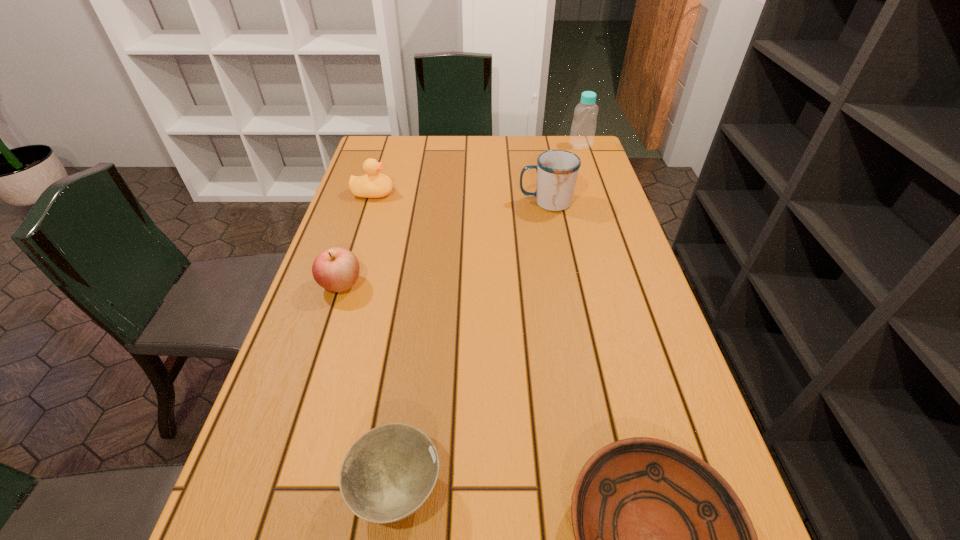
Where is `free space located on the back of the apple`? free space located on the back of the apple is located at coordinates (370, 194).

This screenshot has height=540, width=960. I want to click on object that is at the far edge, so click(583, 127).

Find the location of `duck that is at the left edge`. duck that is at the left edge is located at coordinates (374, 184).

This screenshot has height=540, width=960. Find the location of `apple that is at the left edge`. apple that is at the left edge is located at coordinates (336, 269).

At what (x,y) coordinates should I click in order to perform the action: click on bottle located in the right edge section of the desktop. Please return your answer as a coordinate pair (x, y). This screenshot has height=540, width=960. Looking at the image, I should click on (583, 127).

At what (x,y) coordinates should I click in order to perform the action: click on mug present at the right edge. Please return your answer as a coordinate pair (x, y). The image size is (960, 540). Looking at the image, I should click on (557, 170).

Locate an element on the screen. This screenshot has width=960, height=540. object present at the far right corner is located at coordinates (583, 127).

Find the location of a particular element. vacant space at the far edge of the desktop is located at coordinates (424, 146).

Identify the location of vacant space at the left edge of the desktop. Image resolution: width=960 pixels, height=540 pixels. (336, 372).

Locate an element on the screen. This screenshot has width=960, height=540. free space at the right edge of the desktop is located at coordinates (643, 284).